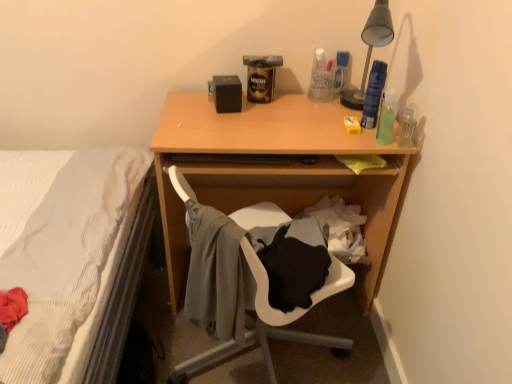
You are a GUI agent. You are given a task and a screenshot of the screen. Output one action in this format:
    pyautogui.click(x=<x>, y=<y>)
    Task: Click on the vacant region in front of translucent plastic bottle at upper right, placed as the 1th bottle when sorted from back to front
    
    Given the screenshot: What is the action you would take?
    pyautogui.click(x=322, y=114)